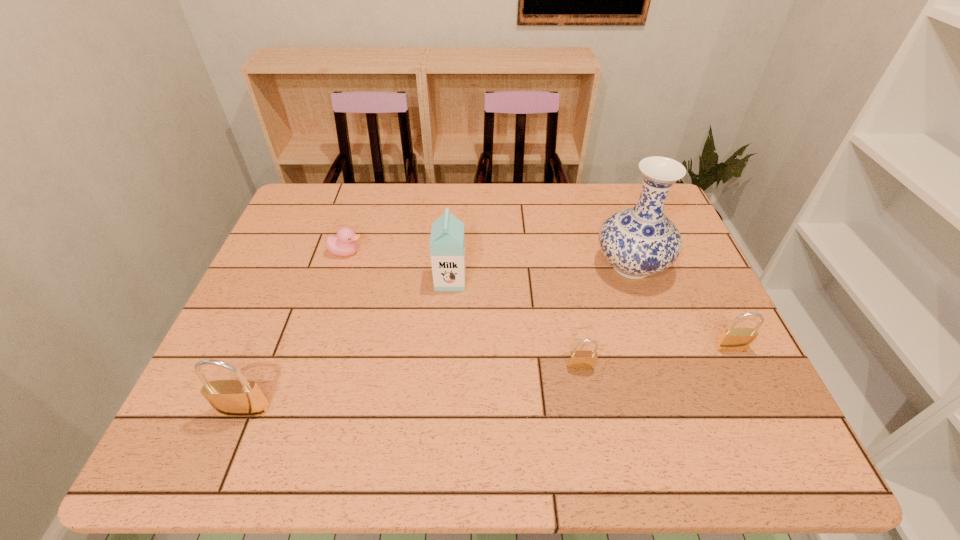
Identify the location of padlock that is the third nearest to the second tallest object. (732, 339).

You are a GUI agent. You are given a task and a screenshot of the screen. Output one action in this format:
    pyautogui.click(x=<x>, y=<y>)
    Task: Click on the closest padlock relative to the milk carton
    This screenshot has height=540, width=960.
    Given the screenshot: What is the action you would take?
    pyautogui.click(x=578, y=360)

The width and height of the screenshot is (960, 540). Find the location of `free point that satisfies the following two spatial constraints: 1. on the front-facing side of the duckling; 2. on the left side of the fourth object from right to left`. free point that satisfies the following two spatial constraints: 1. on the front-facing side of the duckling; 2. on the left side of the fourth object from right to left is located at coordinates (338, 280).

In order to click on vacant position in the image that satisfies the following two spatial constraints: 1. on the front-facing side of the second object from left to right; 2. on the front-facing side of the fourth shortest object in this screenshot , I will do pyautogui.click(x=297, y=409).